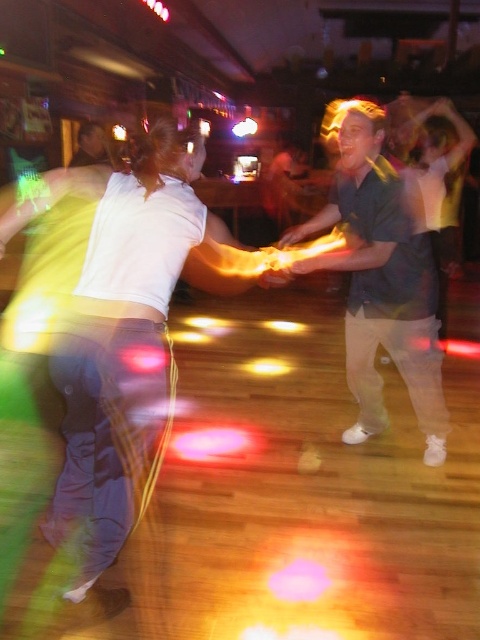
Looking at this image, you are a photographer trying to capture the main dancers in the center of the image. The white matte pants at center and dark green shirt at center are both important subjects. Which clothing item should you focus on to ensure it takes up more of the frame?

The dark green shirt at center occupies more space than the white matte pants at center, so focusing on the dark green shirt at center will ensure it takes up more of the frame.

You are a photographer at the dance floor and want to capture a photo of the white matte pants at center and the dark green shirt at center. Since the lighting is very low, you need to adjust your camera settings. Which object should you focus on first to ensure it appears sharp in the photo?

The white matte pants at center is thinner than dark green shirt at center, so you should focus on the dark green shirt at center first because it has a larger surface area and will be easier to capture sharply in low light.